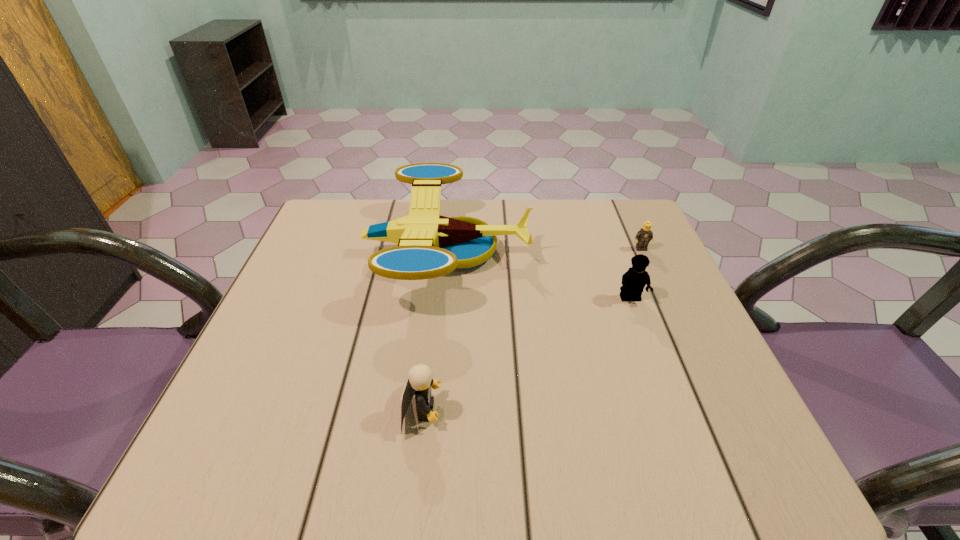
At what (x,y) coordinates should I click in order to perform the action: click on free region at the far right corner. Please return your answer as a coordinate pair (x, y). The height and width of the screenshot is (540, 960). Looking at the image, I should click on (596, 199).

The width and height of the screenshot is (960, 540). Identify the location of vacant space at the near right corner of the desktop. (715, 472).

At what (x,y) coordinates should I click in order to perform the action: click on vacant area that lies between the drone and the nearest Lego. Please return your answer as a coordinate pair (x, y). Image resolution: width=960 pixels, height=540 pixels. Looking at the image, I should click on (434, 332).

Find the location of a particular element. This screenshot has height=540, width=960. free spot between the drone and the shortest object is located at coordinates (544, 251).

The width and height of the screenshot is (960, 540). What are the coordinates of `vacant area that lies between the nearest Lego and the second farthest Lego` in the screenshot? It's located at (526, 354).

Locate an element on the screen. This screenshot has height=540, width=960. vacant space that's between the nearest object and the drone is located at coordinates (434, 332).

Locate an element on the screen. This screenshot has width=960, height=540. free spot between the drone and the nearest object is located at coordinates (434, 332).

In order to click on vacant area that lies between the drone and the rightmost Lego in this screenshot , I will do `click(544, 251)`.

At what (x,y) coordinates should I click in order to perform the action: click on empty space between the second Lego from right to left and the drone. Please return your answer as a coordinate pair (x, y). The height and width of the screenshot is (540, 960). Looking at the image, I should click on (539, 276).

I want to click on vacant space that's between the leftmost Lego and the second nearest Lego, so click(x=526, y=354).